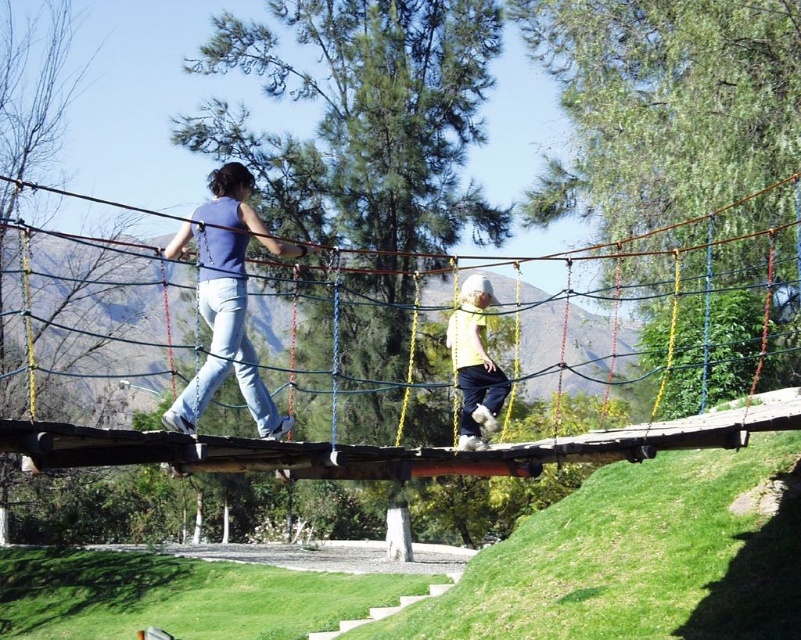
You are a photographer trying to capture a photo of the wooden suspension bridge at center and the matte blue tank top at center. Based on their sizes in the image, which object would appear smaller in the photo?

The wooden suspension bridge at center appears smaller in the photo because it is shorter than the matte blue tank top at center.

You are standing on the suspension bridge and want to walk towards the nearest point between point (377, 477) and point (461, 417). Which point should you walk towards?

You should walk towards point (377, 477) because it is closer to the camera than point (461, 417).

You are a photographer trying to capture the two people on the suspension bridge. You notice the matte blue tank top at center and the light yellow fabric at center. Which clothing item should you focus on if you want to emphasize size differences between the two figures?

The matte blue tank top at center is larger in size than the light yellow fabric at center, so focusing on the matte blue tank top at center would better emphasize the size differences between the two figures.